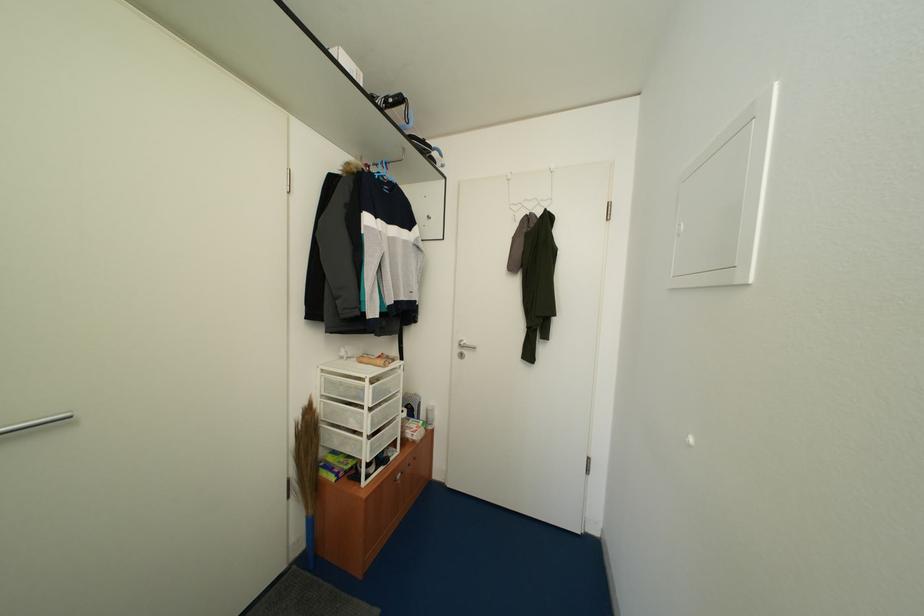
Where is `dark cabinet handle`? dark cabinet handle is located at coordinates (398, 476).